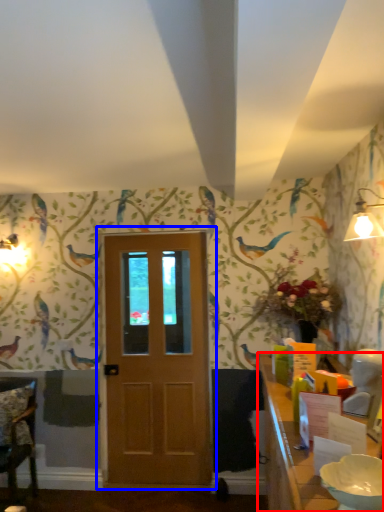
Question: Which object appears closest to the camera in this image, table (highlighted by a red box) or door (highlighted by a blue box)?

Choices:
 (A) table
 (B) door

Answer: (A)